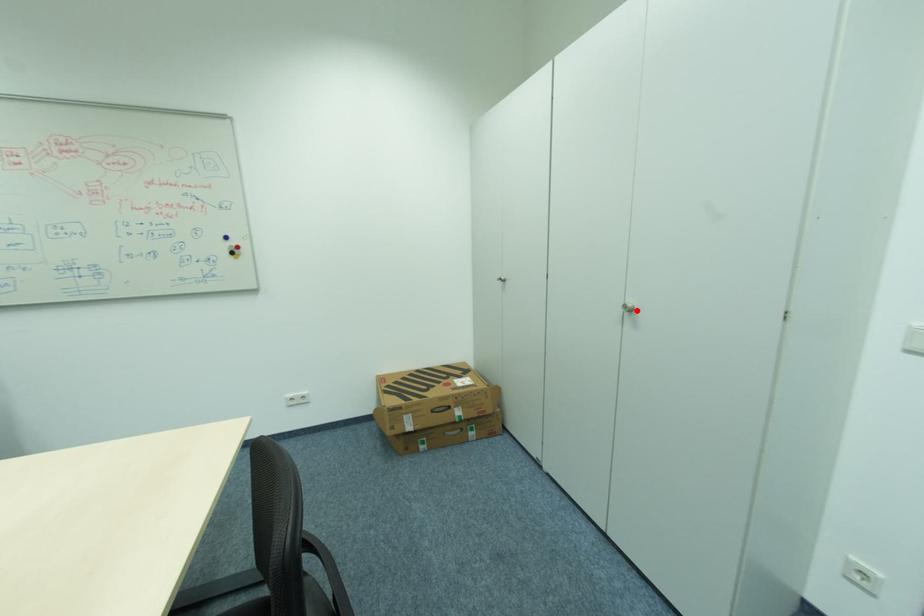
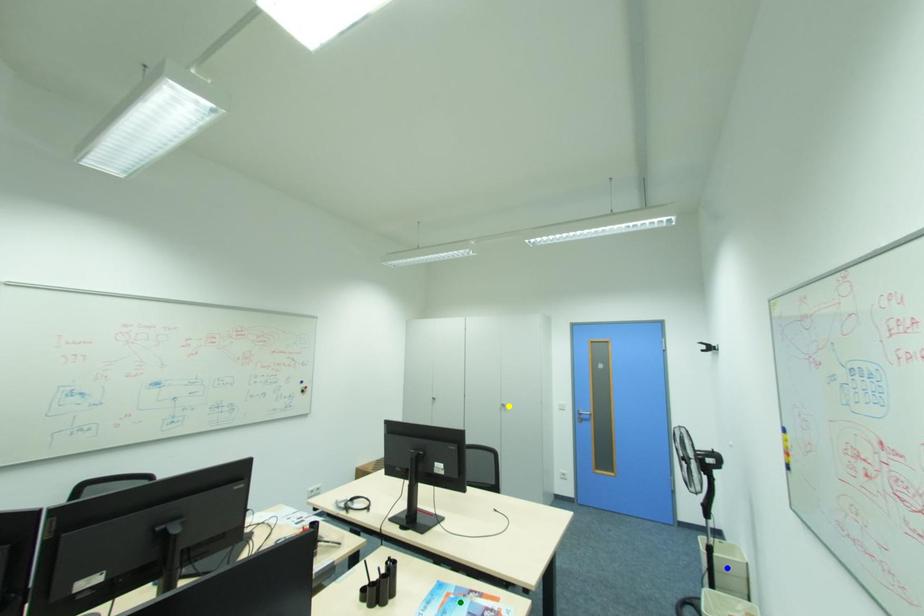
Question: I am providing you with two images of the same scene from different viewpoints. A red point is marked on the first image. You are given multiple points on the second image. In image 2, which mark is for the same physical point as the one in image 1?

Choices:
 (A) yellow point
 (B) blue point
 (C) green point

Answer: (A)